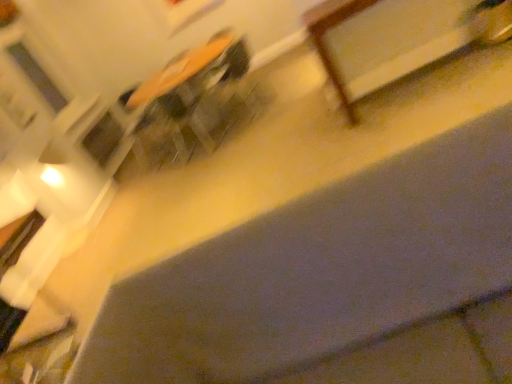
Measure the distance between wooden frame at upper right and camera.

The distance of wooden frame at upper right from camera is 2.80 meters.

I want to click on wooden frame at upper right, so click(397, 38).

The width and height of the screenshot is (512, 384). Describe the element at coordinates (397, 38) in the screenshot. I see `wooden frame at upper right` at that location.

Locate an element on the screen. This screenshot has width=512, height=384. wooden frame at upper right is located at coordinates (397, 38).